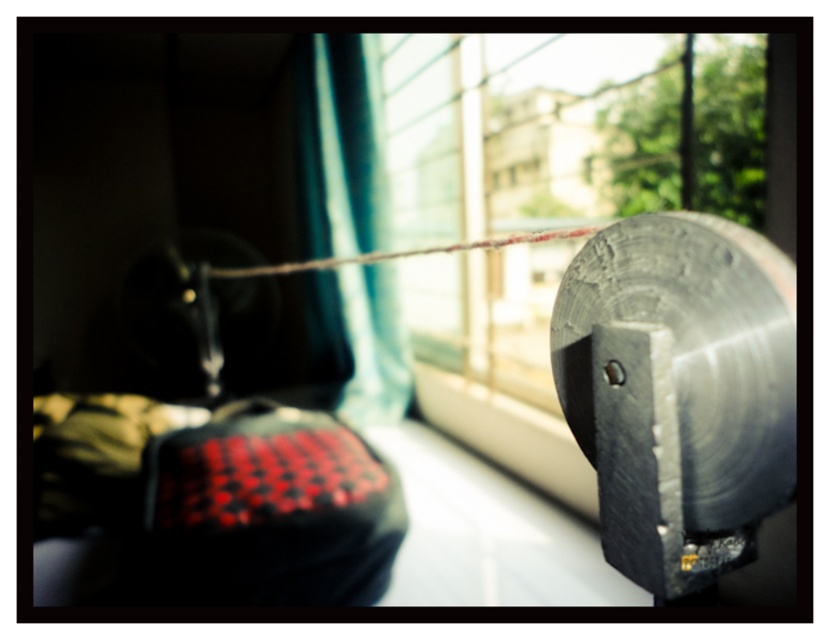
You are an interior designer planning to install a new light fixture. The teal fabric curtain at center is currently hanging at point 0.230, 0.405. If the light fixture must be placed at least 0.3 meters away from any hanging objects, will the light fixture at point 0.250, 0.450 be positioned safely?

The distance between the teal fabric curtain at center at point (335,147) and the light fixture at (373,160) can be calculated using the distance formula. The horizontal difference is 0.020 and the vertical difference is 0.045. The total distance is sqrt0.020 squared plus 0.045 squared which equals approximately 0.049 meters. Since 0.049 meters is less than 0.3 meters, the light fixture is too close to the teal fabric curtain at center and does not meet the safety requirement.

You are an interior designer assessing the space for a new installation. You notice the teal fabric curtain at center and the rusty wire at center. Which object would you describe as having a smaller width when viewed from the front?

The teal fabric curtain at center is thinner than the rusty wire at center, so it has a smaller width when viewed from the front.